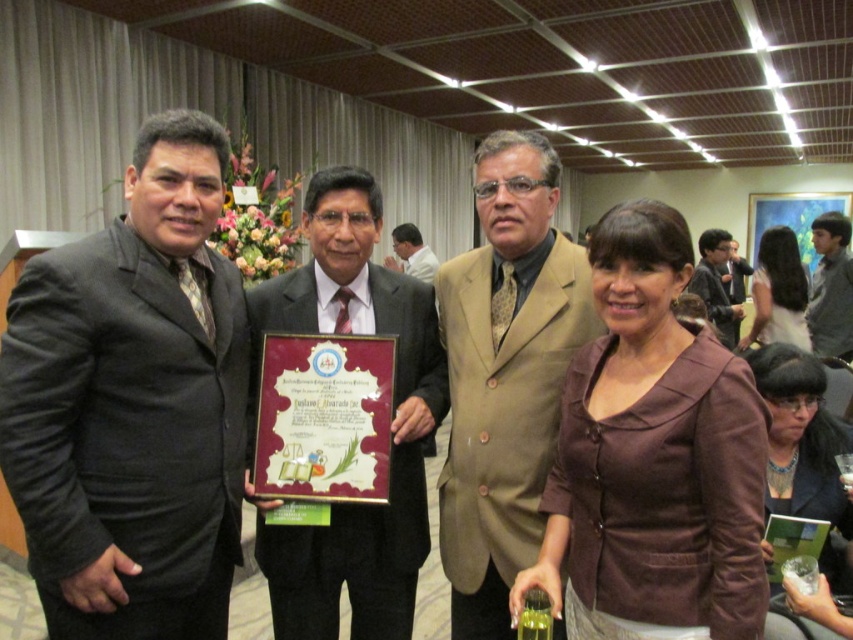
Looking at this image, can you confirm if brown fabric jacket at lower right is positioned above white shirt at center?

No.

Is point (846, 499) closer to viewer compared to point (436, 260)?

Yes, it is in front of point (436, 260).

Is point (775, 467) in front of point (426, 262)?

That is True.

At what (x,y) coordinates should I click in order to perform the action: click on brown fabric jacket at lower right. Please return your answer as a coordinate pair (x, y). Looking at the image, I should click on (801, 438).

Can you confirm if brown textured suit at center is positioned to the left of shiny black suit at center?

In fact, brown textured suit at center is to the right of shiny black suit at center.

Which of these two, brown textured suit at center or shiny black suit at center, stands taller?

With more height is shiny black suit at center.

Between point (548, 330) and point (326, 211), which one is positioned in front?

Positioned in front is point (548, 330).

Find the location of `brown textured suit at center`. brown textured suit at center is located at coordinates (505, 374).

Does point (149, 627) lie in front of point (822, 493)?

That is True.

Can you confirm if dark gray suit at left is positioned below brown fabric jacket at lower right?

Incorrect, dark gray suit at left is not positioned below brown fabric jacket at lower right.

Between point (123, 337) and point (799, 508), which one is positioned behind?

The point (799, 508) is more distant.

The width and height of the screenshot is (853, 640). Find the location of `dark gray suit at left`. dark gray suit at left is located at coordinates (132, 403).